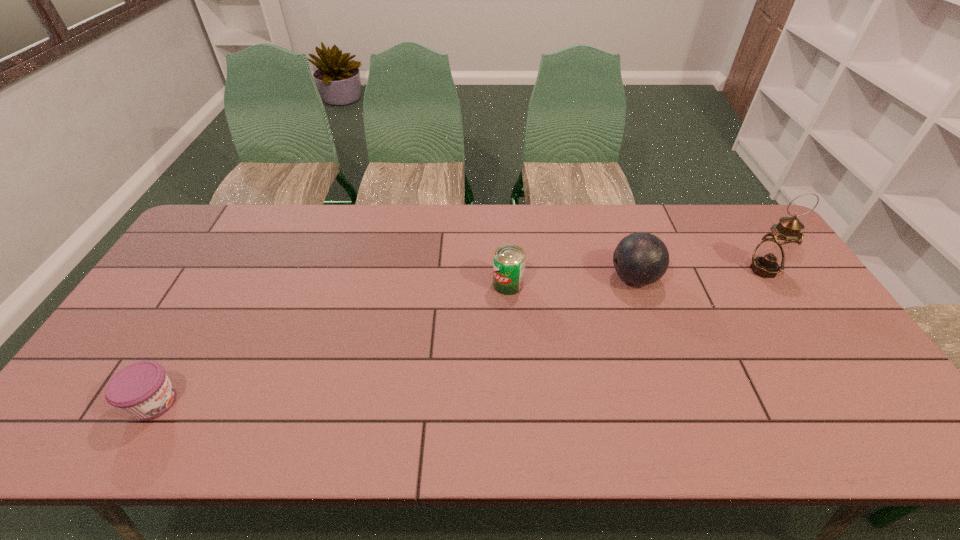
Locate an element on the screen. oil lamp is located at coordinates (771, 255).

Where is `the rightmost object`? The image size is (960, 540). the rightmost object is located at coordinates (771, 255).

This screenshot has width=960, height=540. What are the coordinates of `bowling ball` in the screenshot? It's located at (641, 258).

Identify the location of the second object from right to left. (641, 258).

At what (x,y) coordinates should I click in order to perform the action: click on can. Please return your answer as a coordinate pair (x, y). This screenshot has width=960, height=540. Looking at the image, I should click on (509, 260).

You are a GUI agent. You are given a task and a screenshot of the screen. Output one action in this format:
    pyautogui.click(x=<x>, y=<y>)
    Task: Click on the third tallest object
    This screenshot has width=960, height=540.
    Given the screenshot: What is the action you would take?
    pyautogui.click(x=509, y=260)

In order to click on the leftmost object in this screenshot , I will do `click(142, 389)`.

The width and height of the screenshot is (960, 540). In order to click on jam in this screenshot , I will do `click(142, 389)`.

Locate an element on the screen. This screenshot has width=960, height=540. blank space located 0.170m on the front of the oil lamp is located at coordinates (799, 325).

What are the coordinates of `free space located on the grip area of the third object from left to right` in the screenshot? It's located at (503, 278).